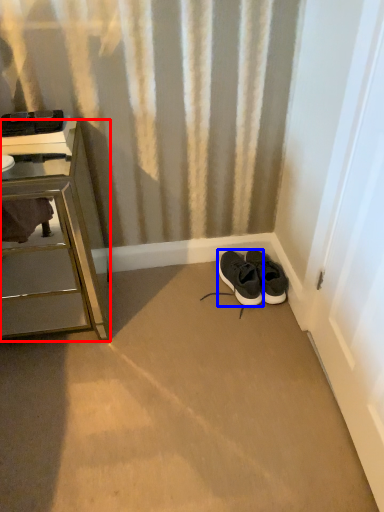
Question: Which object appears farthest to the camera in this image, chest of drawers (highlighted by a red box) or shoe (highlighted by a blue box)?

Choices:
 (A) chest of drawers
 (B) shoe

Answer: (B)